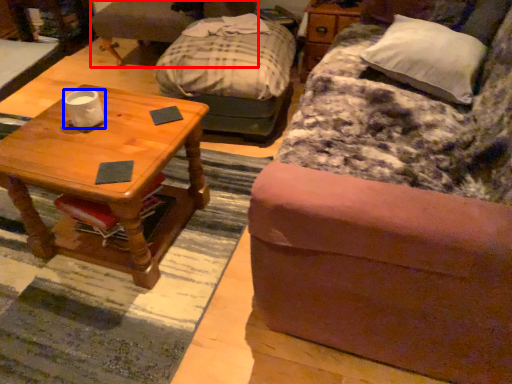
Question: Which of the following is the farthest to the observer, swivel chair (highlighted by a red box) or coffee cup (highlighted by a blue box)?

Choices:
 (A) swivel chair
 (B) coffee cup

Answer: (A)